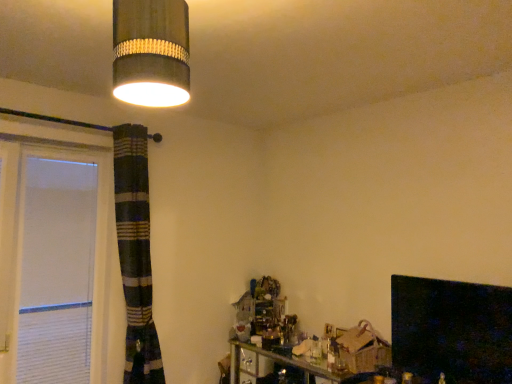
Question: From their relative heights in the image, would you say black glossy fireplace at lower right is taller or shorter than matte gray cylindrical lampshade at upper left?

Choices:
 (A) short
 (B) tall

Answer: (B)

Question: Based on their positions, is black glossy fireplace at lower right located to the left or right of matte gray cylindrical lampshade at upper left?

Choices:
 (A) right
 (B) left

Answer: (A)

Question: In the image, is black glossy fireplace at lower right positioned in front of or behind matte gray cylindrical lampshade at upper left?

Choices:
 (A) behind
 (B) front

Answer: (A)

Question: In terms of height, does matte gray cylindrical lampshade at upper left look taller or shorter compared to black glossy fireplace at lower right?

Choices:
 (A) tall
 (B) short

Answer: (B)

Question: Is point click(140, 66) positioned closer to the camera than point click(434, 372)?

Choices:
 (A) closer
 (B) farther

Answer: (A)

Question: In the image, is matte gray cylindrical lampshade at upper left positioned in front of or behind black glossy fireplace at lower right?

Choices:
 (A) front
 (B) behind

Answer: (A)

Question: Would you say matte gray cylindrical lampshade at upper left is inside or outside black glossy fireplace at lower right?

Choices:
 (A) outside
 (B) inside

Answer: (A)